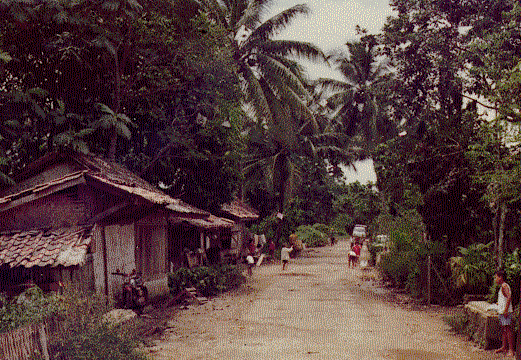
You are a GUI agent. You are given a task and a screenshot of the screen. Output one action in this format:
    pyautogui.click(x=<x>, y=<y>)
    Task: Click on the white wood
    
    Given the screenshot: What is the action you would take?
    pyautogui.click(x=120, y=244)